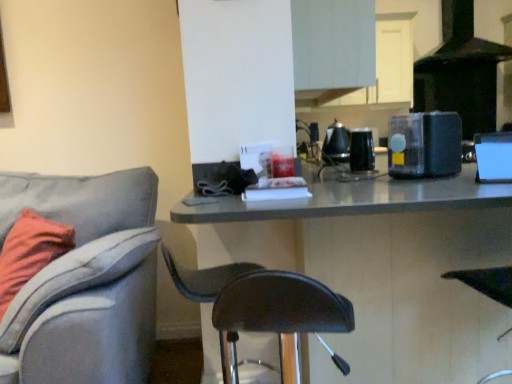
Question: Is black plastic blender at upper right, which appears as the 2th appliance when viewed from the front, facing away from blue glossy speaker at right, which is the fourth appliance in back-to-front order?

Choices:
 (A) yes
 (B) no

Answer: (B)

Question: Does black plastic blender at upper right, which appears as the 3th appliance when viewed from the back, have a larger size compared to blue glossy speaker at right, positioned as the first appliance in front-to-back order?

Choices:
 (A) no
 (B) yes

Answer: (B)

Question: Is black plastic blender at upper right, which appears as the 2th appliance when viewed from the front, further to camera compared to blue glossy speaker at right, which is the fourth appliance in back-to-front order?

Choices:
 (A) yes
 (B) no

Answer: (A)

Question: Is black plastic blender at upper right, which appears as the 3th appliance when viewed from the back, located outside blue glossy speaker at right, which is the fourth appliance in back-to-front order?

Choices:
 (A) no
 (B) yes

Answer: (B)

Question: Considering the relative positions of black plastic blender at upper right, which appears as the 2th appliance when viewed from the front, and blue glossy speaker at right, positioned as the first appliance in front-to-back order, in the image provided, is black plastic blender at upper right, which appears as the 2th appliance when viewed from the front, to the left of blue glossy speaker at right, positioned as the first appliance in front-to-back order, from the viewer's perspective?

Choices:
 (A) no
 (B) yes

Answer: (B)

Question: Is black matte exhaust hood at upper right in front of or behind black plastic blender at upper right, which appears as the 2th appliance when viewed from the front, in the image?

Choices:
 (A) front
 (B) behind

Answer: (B)

Question: In terms of size, does black matte exhaust hood at upper right appear bigger or smaller than black plastic blender at upper right, which appears as the 2th appliance when viewed from the front?

Choices:
 (A) small
 (B) big

Answer: (B)

Question: Is point (488, 46) closer or farther from the camera than point (403, 152)?

Choices:
 (A) farther
 (B) closer

Answer: (A)

Question: In terms of width, does black matte exhaust hood at upper right look wider or thinner when compared to black plastic blender at upper right, which appears as the 2th appliance when viewed from the front?

Choices:
 (A) thin
 (B) wide

Answer: (B)

Question: From a real-world perspective, is black glossy kettle at upper center, marked as the 1th appliance in a back-to-front arrangement, physically located above or below blue glossy speaker at right, which is the fourth appliance in back-to-front order?

Choices:
 (A) below
 (B) above

Answer: (B)

Question: Considering the positions of black glossy kettle at upper center, which is the fourth appliance in front-to-back order, and blue glossy speaker at right, which is the fourth appliance in back-to-front order, in the image, is black glossy kettle at upper center, which is the fourth appliance in front-to-back order, wider or thinner than blue glossy speaker at right, which is the fourth appliance in back-to-front order,?

Choices:
 (A) wide
 (B) thin

Answer: (A)

Question: From their relative heights in the image, would you say black glossy kettle at upper center, marked as the 1th appliance in a back-to-front arrangement, is taller or shorter than blue glossy speaker at right, which is the fourth appliance in back-to-front order?

Choices:
 (A) short
 (B) tall

Answer: (B)

Question: Is black glossy kettle at upper center, which is the fourth appliance in front-to-back order, situated inside blue glossy speaker at right, positioned as the first appliance in front-to-back order, or outside?

Choices:
 (A) inside
 (B) outside

Answer: (B)

Question: Based on their sizes in the image, would you say black glossy kettle at upper center, marked as the 1th appliance in a back-to-front arrangement, is bigger or smaller than black glossy coffee maker at upper center, which ranks as the third appliance in front-to-back order?

Choices:
 (A) small
 (B) big

Answer: (B)

Question: Relative to black glossy coffee maker at upper center, which ranks as the third appliance in front-to-back order, is black glossy kettle at upper center, which is the fourth appliance in front-to-back order, in front or behind?

Choices:
 (A) front
 (B) behind

Answer: (B)